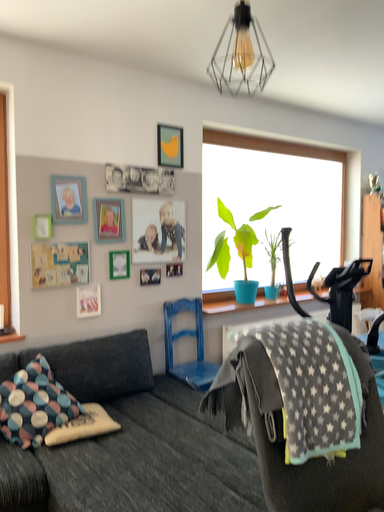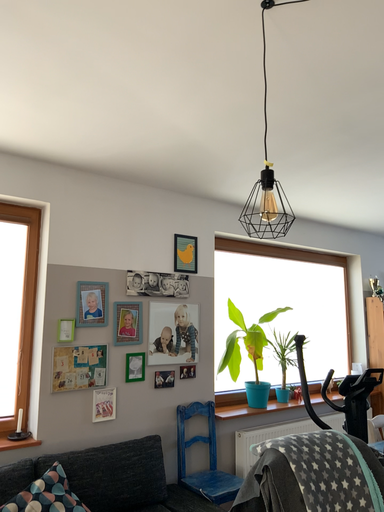
Question: Which way did the camera rotate in the video?

Choices:
 (A) rotated downward
 (B) rotated upward

Answer: (B)